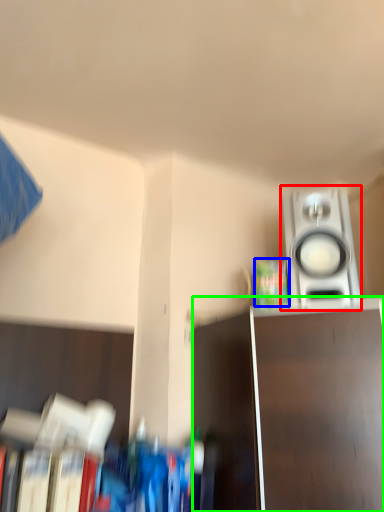
Question: Based on their relative distances, which object is farther from home appliance (highlighted by a red box)? Choose from paperback book (highlighted by a blue box) and furniture (highlighted by a green box).

Choices:
 (A) paperback book
 (B) furniture

Answer: (B)